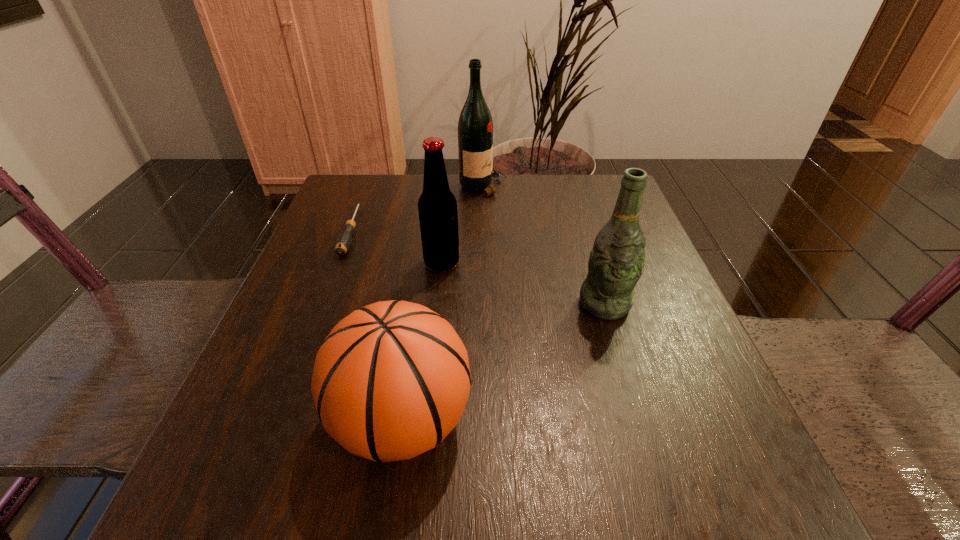
At what (x,y) coordinates should I click in order to perform the action: click on object at the near left corner. Please return your answer as a coordinate pair (x, y). Looking at the image, I should click on (391, 380).

This screenshot has height=540, width=960. What are the coordinates of `vacant area at the far edge` in the screenshot? It's located at [541, 205].

Where is `vacant area at the near edge`? The width and height of the screenshot is (960, 540). vacant area at the near edge is located at coordinates (527, 491).

This screenshot has height=540, width=960. I want to click on vacant space at the left edge, so [281, 338].

Find the location of `free space at the right edge`. free space at the right edge is located at coordinates (637, 423).

The height and width of the screenshot is (540, 960). In the image, there is a desktop. What are the coordinates of `vacant space at the far left corner` in the screenshot? It's located at (360, 195).

In the image, there is a desktop. At what (x,y) coordinates should I click in order to perform the action: click on vacant space at the near left corner. Please return your answer as a coordinate pair (x, y). Image resolution: width=960 pixels, height=540 pixels. Looking at the image, I should click on (225, 503).

The height and width of the screenshot is (540, 960). Identify the location of free location at the far right corner. (588, 219).

Where is `free space at the near right corner`? Image resolution: width=960 pixels, height=540 pixels. free space at the near right corner is located at coordinates (758, 530).

Where is `empty location between the wine bottle and the nearest object`? The image size is (960, 540). empty location between the wine bottle and the nearest object is located at coordinates point(443,304).